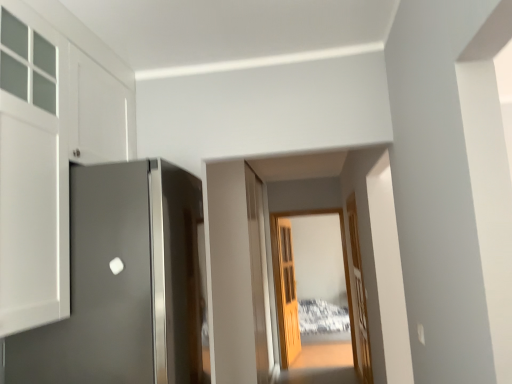
Question: Does light brown wooden door at center, the 3th door in the front-to-back sequence, appear on the left side of transparent wooden door at center?

Choices:
 (A) no
 (B) yes

Answer: (B)

Question: Does light brown wooden door at center, marked as the second door in a left-to-right arrangement, have a greater height compared to transparent wooden door at center?

Choices:
 (A) yes
 (B) no

Answer: (B)

Question: Is light brown wooden door at center, the 3th door in the front-to-back sequence, further to the viewer compared to transparent wooden door at center?

Choices:
 (A) no
 (B) yes

Answer: (B)

Question: Is light brown wooden door at center, the 1th door when ordered from back to front, at the right side of transparent wooden door at center?

Choices:
 (A) yes
 (B) no

Answer: (B)

Question: From a real-world perspective, is light brown wooden door at center, the 3th door in the front-to-back sequence, on transparent wooden door at center?

Choices:
 (A) yes
 (B) no

Answer: (B)

Question: From their relative heights in the image, would you say transparent wooden door at center is taller or shorter than light brown wooden door at center, the 1th door when ordered from back to front?

Choices:
 (A) short
 (B) tall

Answer: (B)

Question: Is point (291, 215) closer or farther from the camera than point (289, 230)?

Choices:
 (A) farther
 (B) closer

Answer: (B)

Question: Choose the correct answer: Is transparent wooden door at center inside light brown wooden door at center, the 1th door when ordered from back to front, or outside it?

Choices:
 (A) outside
 (B) inside

Answer: (A)

Question: Relative to light brown wooden door at center, placed as the second door when sorted from right to left, is transparent wooden door at center in front or behind?

Choices:
 (A) behind
 (B) front

Answer: (B)

Question: From their relative heights in the image, would you say wooden door at center, the first door from the right, is taller or shorter than transparent wooden door at center?

Choices:
 (A) tall
 (B) short

Answer: (B)

Question: In terms of size, does wooden door at center, arranged as the second door when viewed from the back, appear bigger or smaller than transparent wooden door at center?

Choices:
 (A) small
 (B) big

Answer: (A)

Question: Does point (366, 327) appear closer or farther from the camera than point (285, 347)?

Choices:
 (A) farther
 (B) closer

Answer: (B)

Question: From the image's perspective, relative to transparent wooden door at center, is wooden door at center, the first door from the right, above or below?

Choices:
 (A) above
 (B) below

Answer: (A)

Question: Considering the positions of light brown wooden door at center, marked as the second door in a left-to-right arrangement, and transparent wooden door at center in the image, is light brown wooden door at center, marked as the second door in a left-to-right arrangement, taller or shorter than transparent wooden door at center?

Choices:
 (A) short
 (B) tall

Answer: (A)

Question: Considering the positions of light brown wooden door at center, the 1th door when ordered from back to front, and transparent wooden door at center in the image, is light brown wooden door at center, the 1th door when ordered from back to front, wider or thinner than transparent wooden door at center?

Choices:
 (A) thin
 (B) wide

Answer: (A)